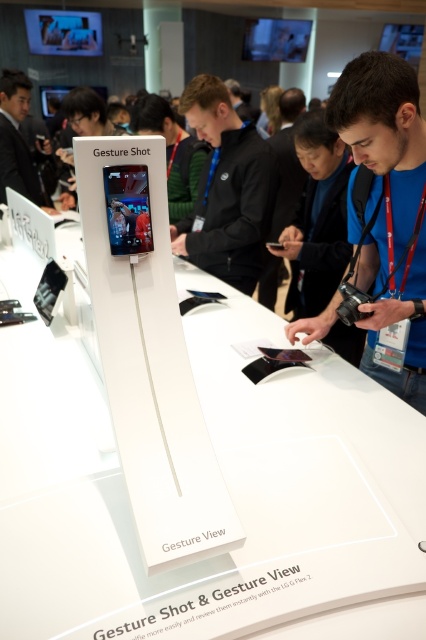
Question: From the image, what is the correct spatial relationship of blue fabric shirt at center in relation to matte black smartphone at center?

Choices:
 (A) left
 (B) right

Answer: (B)

Question: Which object appears farthest from the camera in this image?

Choices:
 (A) black glossy smartphone at center
 (B) matte black smartphone at center
 (C) matte black phone at upper left
 (D) blue fabric shirt at center

Answer: (C)

Question: Is matte black phone at upper left to the right of black glossy smartphone at center from the viewer's perspective?

Choices:
 (A) no
 (B) yes

Answer: (A)

Question: Which point appears closest to the camera in this image?

Choices:
 (A) (141, 236)
 (B) (201, 129)
 (C) (281, 244)

Answer: (A)

Question: Where is matte black phone at upper left located in relation to black glossy smartphone at center in the image?

Choices:
 (A) left
 (B) right

Answer: (A)

Question: Which object appears farthest from the camera in this image?

Choices:
 (A) blue fabric shirt at center
 (B) black glossy smartphone at center
 (C) matte black phone at upper left

Answer: (C)